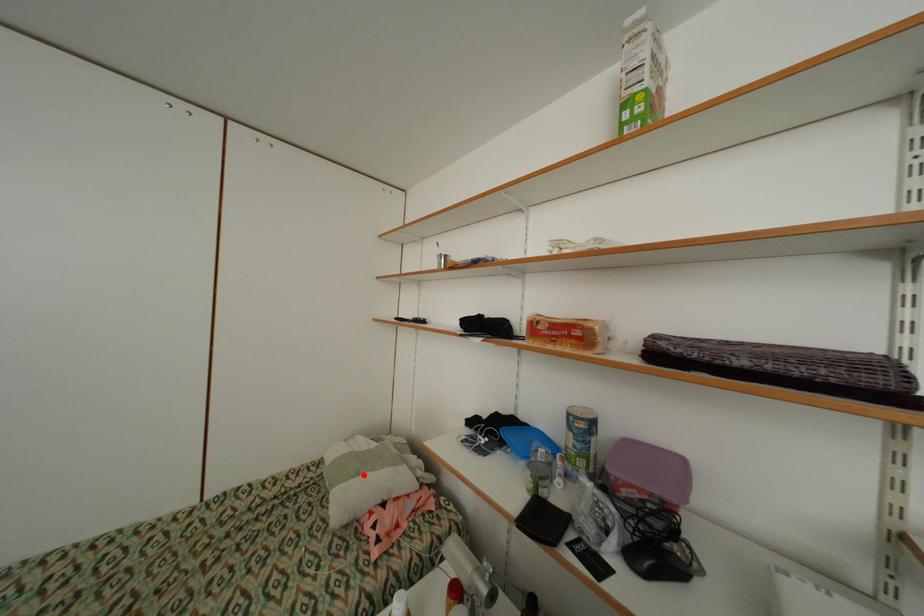
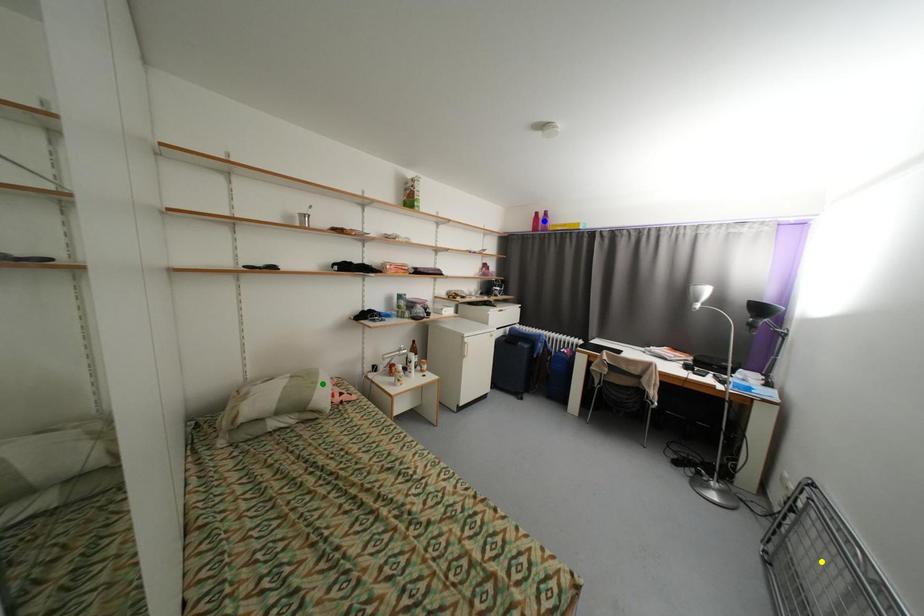
Question: I am providing you with two images of the same scene from different viewpoints. A red point is marked on the first image. You are given multiple points on the second image. Which mark in image 2 goes with the point in image 1?

Choices:
 (A) blue point
 (B) yellow point
 (C) green point

Answer: (C)